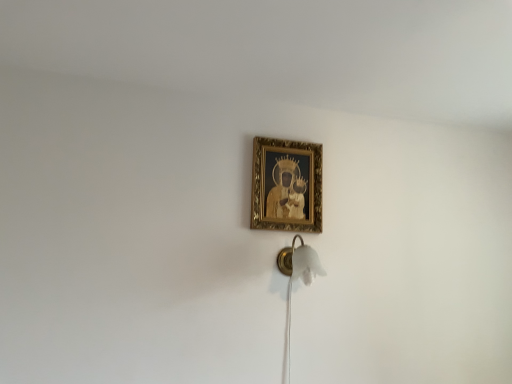
Locate an element on the screen. gold ornate frame at upper center is located at coordinates (286, 185).

Describe the element at coordinates (286, 185) in the screenshot. I see `gold ornate frame at upper center` at that location.

The height and width of the screenshot is (384, 512). In order to click on gold ornate frame at upper center in this screenshot , I will do `click(286, 185)`.